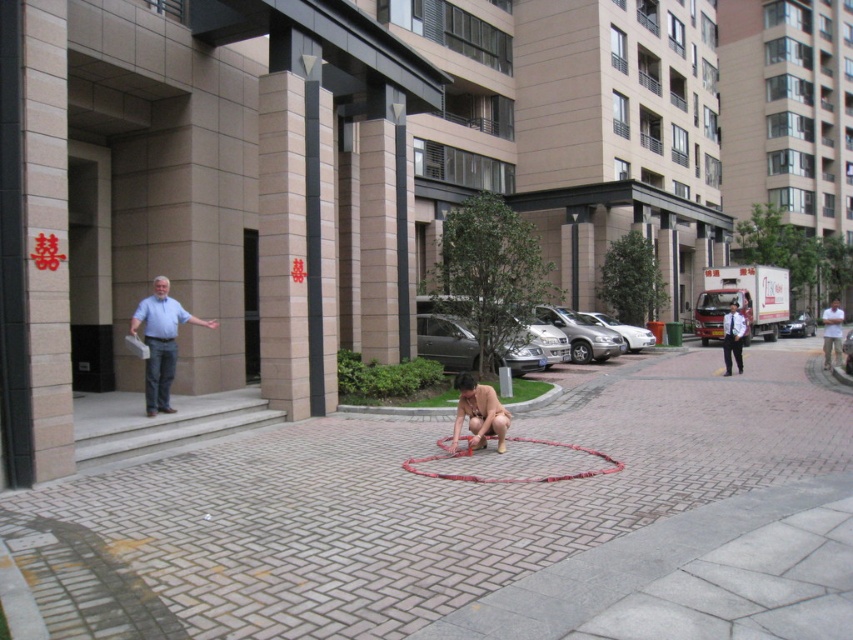
Question: Which object is farther from the camera taking this photo?

Choices:
 (A) brick pavement at center
 (B) light blue shirt at center
 (C) matte red hula hoop at center

Answer: (B)

Question: Estimate the real-world distances between objects in this image. Which object is closer to the white cotton shirt at right?

Choices:
 (A) matte red hula hoop at center
 (B) light blue shirt at center
 (C) brick pavement at center

Answer: (C)

Question: Can you confirm if matte red hula hoop at center is positioned to the right of white cotton shirt at right?

Choices:
 (A) yes
 (B) no

Answer: (B)

Question: Can you confirm if white shirt at right is smaller than white cotton shirt at right?

Choices:
 (A) no
 (B) yes

Answer: (B)

Question: Estimate the real-world distances between objects in this image. Which object is closer to the brick pavement at center?

Choices:
 (A) light blue shirt at center
 (B) white cotton shirt at right

Answer: (A)

Question: Is matte red hula hoop at center above white shirt at right?

Choices:
 (A) yes
 (B) no

Answer: (B)